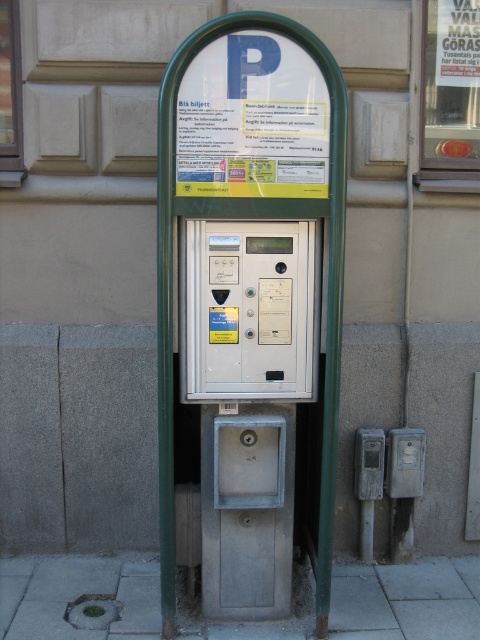
You are a delivery person trying to park your van near the metallic gray parking meter at center. You notice the gray concrete pavement at lower left is where you need to place your parking ticket. Considering the size difference between the two, which object should you focus on to ensure proper parking?

The metallic gray parking meter at center is bigger than the gray concrete pavement at lower left, so you should focus on the metallic gray parking meter at center to ensure proper parking as it is the designated location for parking procedures.